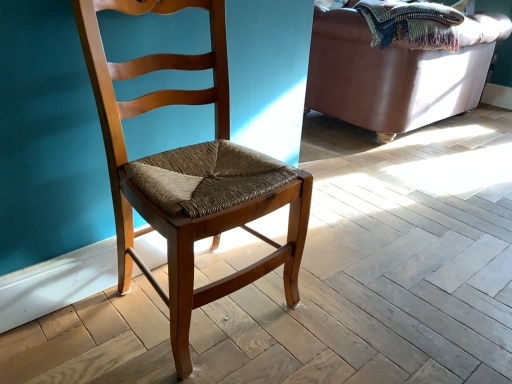
Question: Would you say leather couch at upper right is a long distance from wooden chair at center?

Choices:
 (A) yes
 (B) no

Answer: (A)

Question: From the image's perspective, does leather couch at upper right appear higher than wooden chair at center?

Choices:
 (A) yes
 (B) no

Answer: (A)

Question: Is leather couch at upper right with wooden chair at center?

Choices:
 (A) no
 (B) yes

Answer: (A)

Question: From the image's perspective, is leather couch at upper right under wooden chair at center?

Choices:
 (A) yes
 (B) no

Answer: (B)

Question: Considering the relative sizes of leather couch at upper right and wooden chair at center in the image provided, is leather couch at upper right thinner than wooden chair at center?

Choices:
 (A) no
 (B) yes

Answer: (A)

Question: Is leather couch at upper right further to the viewer compared to wooden chair at center?

Choices:
 (A) yes
 (B) no

Answer: (A)

Question: Is wooden chair at center far away from leather couch at upper right?

Choices:
 (A) yes
 (B) no

Answer: (A)

Question: Is wooden chair at center bigger than leather couch at upper right?

Choices:
 (A) yes
 (B) no

Answer: (B)

Question: From the image's perspective, is wooden chair at center located beneath leather couch at upper right?

Choices:
 (A) yes
 (B) no

Answer: (A)

Question: Considering the relative sizes of wooden chair at center and leather couch at upper right in the image provided, is wooden chair at center thinner than leather couch at upper right?

Choices:
 (A) no
 (B) yes

Answer: (B)

Question: Is wooden chair at center surrounding leather couch at upper right?

Choices:
 (A) no
 (B) yes

Answer: (A)

Question: Are wooden chair at center and leather couch at upper right making contact?

Choices:
 (A) no
 (B) yes

Answer: (A)

Question: Is woven multicolored blanket at upper right wider than wooden chair at center?

Choices:
 (A) no
 (B) yes

Answer: (B)